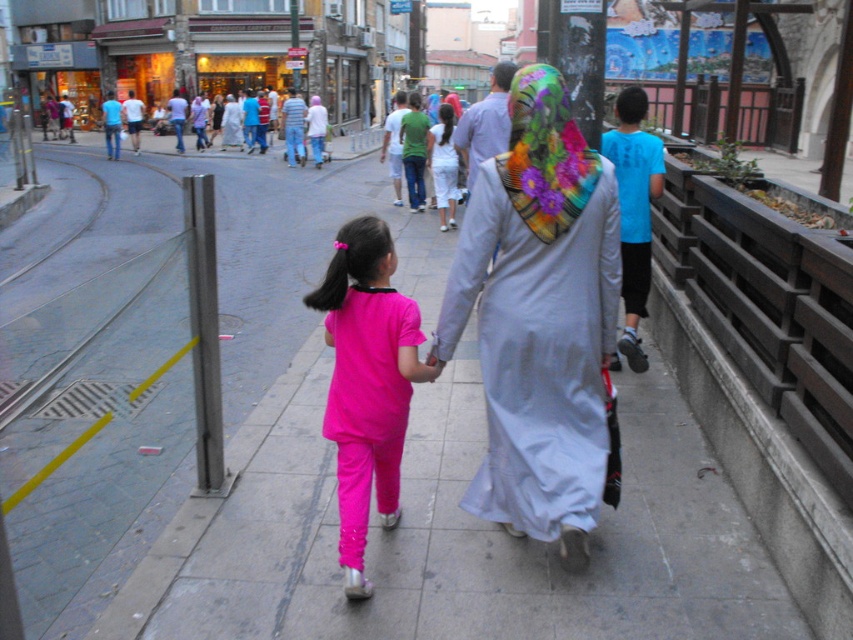
Does point (364, 300) come farther from viewer compared to point (625, 300)?

No, (364, 300) is in front of (625, 300).

Who is more forward, (x=405, y=340) or (x=643, y=145)?

Point (x=405, y=340) is more forward.

The height and width of the screenshot is (640, 853). I want to click on pink matte pants at center, so click(366, 381).

Who is higher up, light gray fabric dress at center or blue t-shirt at right?

blue t-shirt at right is higher up.

Is light gray fabric dress at center taller than blue t-shirt at right?

Correct, light gray fabric dress at center is much taller as blue t-shirt at right.

The image size is (853, 640). I want to click on light gray fabric dress at center, so click(x=538, y=317).

The image size is (853, 640). Identify the location of light gray fabric dress at center. (538, 317).

Is light gray fabric dress at center taller than pink matte pants at center?

Indeed, light gray fabric dress at center has a greater height compared to pink matte pants at center.

Is light gray fabric dress at center to the left of pink matte pants at center from the viewer's perspective?

No, light gray fabric dress at center is not to the left of pink matte pants at center.

The height and width of the screenshot is (640, 853). Describe the element at coordinates (538, 317) in the screenshot. I see `light gray fabric dress at center` at that location.

Where is `light gray fabric dress at center`? Image resolution: width=853 pixels, height=640 pixels. light gray fabric dress at center is located at coordinates (538, 317).